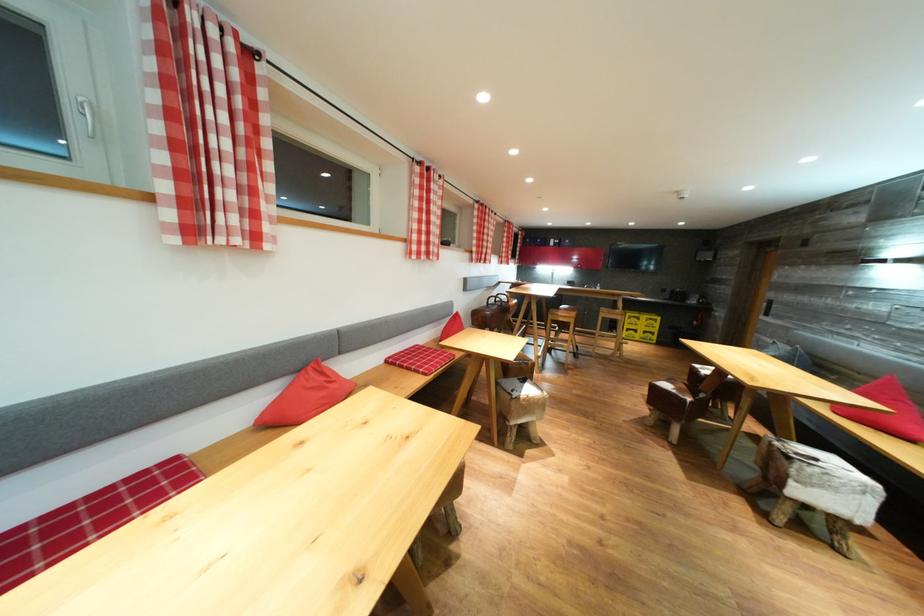
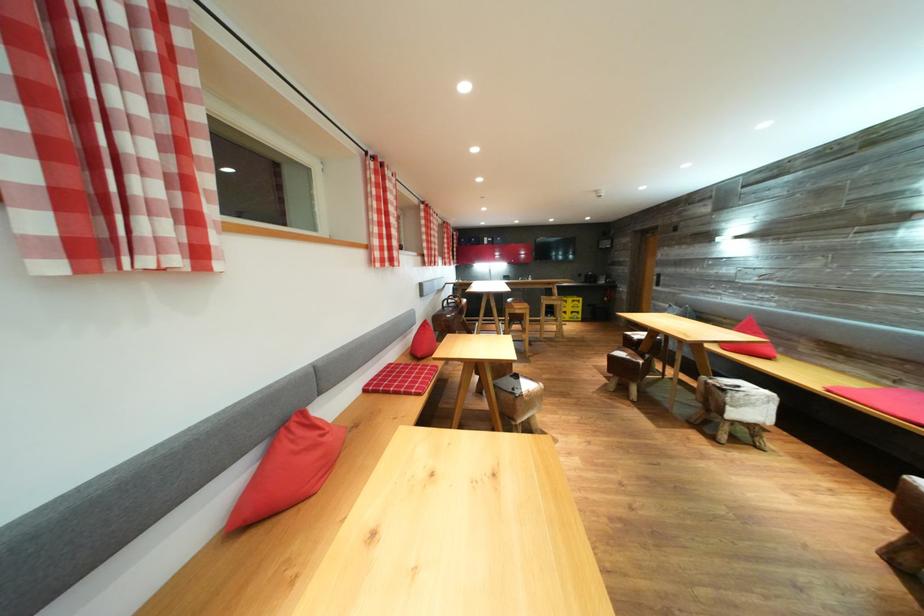
Find the pixel in the second image that matches (x=821, y=464) in the first image.

(745, 392)